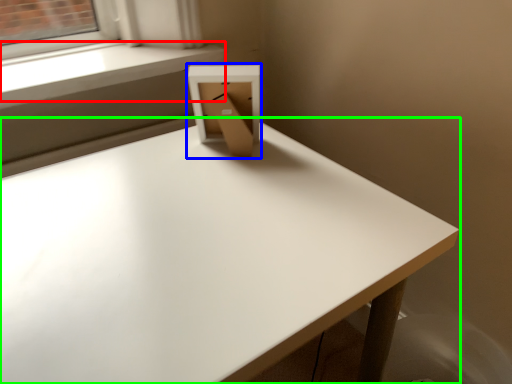
Question: Which object is the closest to the window sill (highlighted by a red box)? Choose among these: cardboard box (highlighted by a blue box) or table (highlighted by a green box).

Choices:
 (A) cardboard box
 (B) table

Answer: (A)